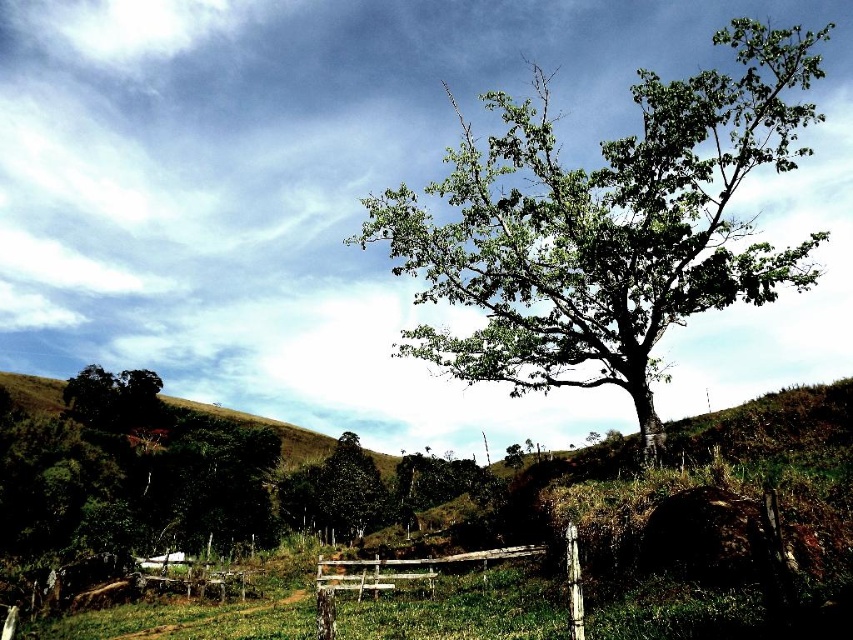
Where is `wooden fence at lower center`? wooden fence at lower center is located at coordinates [393, 576].

Can you confirm if wooden fence at lower center is thinner than dark green leafy tree at lower left?

Correct, wooden fence at lower center's width is less than dark green leafy tree at lower left's.

Does point (347, 563) come closer to viewer compared to point (93, 381)?

Yes.

The width and height of the screenshot is (853, 640). What are the coordinates of `wooden fence at lower center` in the screenshot? It's located at point(393,576).

Between green leafy tree at center and dark green leafy tree at lower left, which one has less height?

With less height is dark green leafy tree at lower left.

Which is behind, point (689, 179) or point (103, 429)?

The point (103, 429) is more distant.

What do you see at coordinates (605, 227) in the screenshot?
I see `green leafy tree at center` at bounding box center [605, 227].

Identify the location of green leafy tree at center. The height and width of the screenshot is (640, 853). (605, 227).

Does green leafy tree at center appear on the left side of wooden fence at lower center?

In fact, green leafy tree at center is to the right of wooden fence at lower center.

Is green leafy tree at center further to the viewer compared to wooden fence at lower center?

Yes, green leafy tree at center is further from the viewer.

Does point (766, 35) lie behind point (426, 561)?

Yes.

Locate an element on the screen. green leafy tree at center is located at coordinates (605, 227).